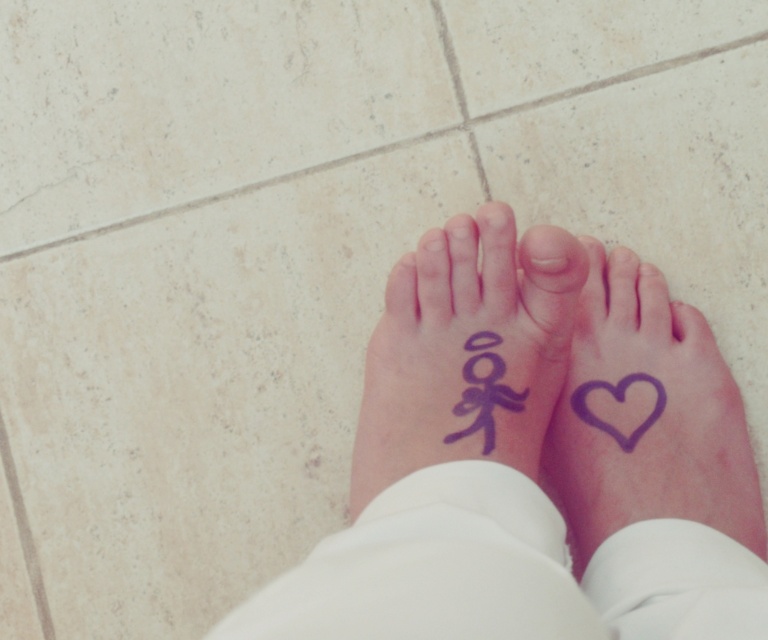
Question: Among these objects, which one is farthest from the camera?

Choices:
 (A) white smooth fabric at lower center
 (B) purple matte heart at lower right
 (C) purple matte heart at center

Answer: (C)

Question: Among these objects, which one is farthest from the camera?

Choices:
 (A) purple matte heart at lower center
 (B) white smooth fabric at lower center
 (C) purple matte stick figure at center
 (D) purple matte heart at center

Answer: (D)

Question: Which object is positioned closest to the white smooth fabric at lower center?

Choices:
 (A) purple matte heart at lower right
 (B) purple ink heart at lower right

Answer: (B)

Question: Is purple matte heart at lower center smaller than purple ink heart at lower right?

Choices:
 (A) no
 (B) yes

Answer: (A)

Question: Where is purple matte heart at lower center located in relation to purple matte stick figure at center in the image?

Choices:
 (A) below
 (B) above

Answer: (A)

Question: Is purple matte stick figure at center positioned in front of white smooth fabric at lower center?

Choices:
 (A) no
 (B) yes

Answer: (A)